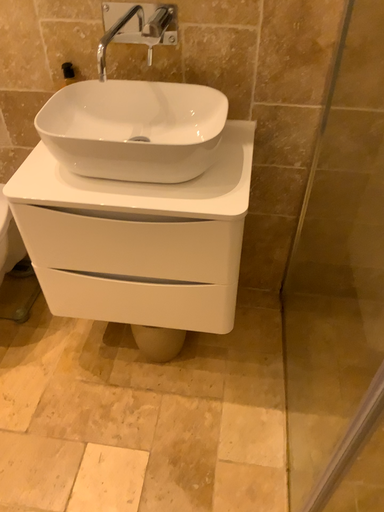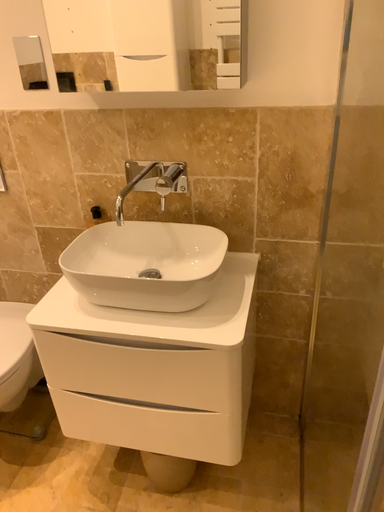
Question: How did the camera likely rotate when shooting the video?

Choices:
 (A) rotated downward
 (B) rotated upward

Answer: (B)